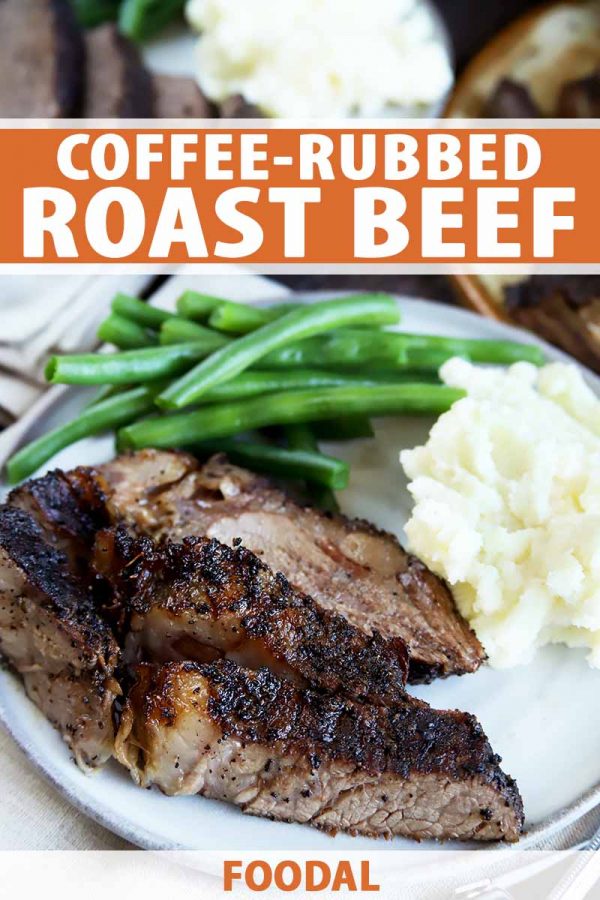
This screenshot has height=900, width=600. I want to click on fabric, so click(45, 816).